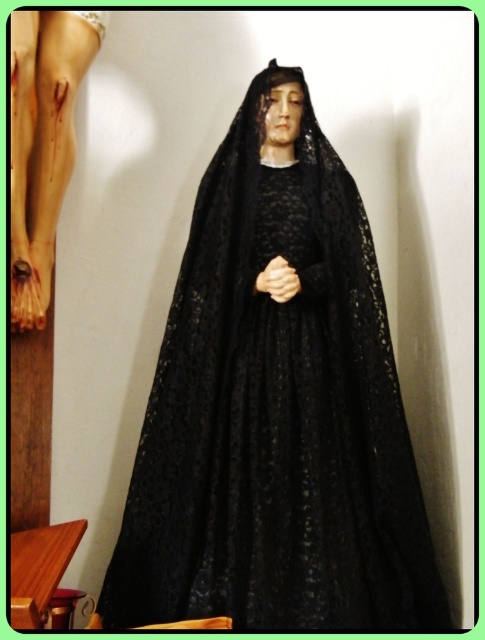
Does black lace statue at center have a lesser height compared to matte black statue at upper center?

Incorrect, black lace statue at center's height does not fall short of matte black statue at upper center's.

Can you confirm if black lace statue at center is thinner than matte black statue at upper center?

No, black lace statue at center is not thinner than matte black statue at upper center.

Image resolution: width=485 pixels, height=640 pixels. I want to click on black lace statue at center, so click(275, 406).

The width and height of the screenshot is (485, 640). I want to click on black lace statue at center, so click(275, 406).